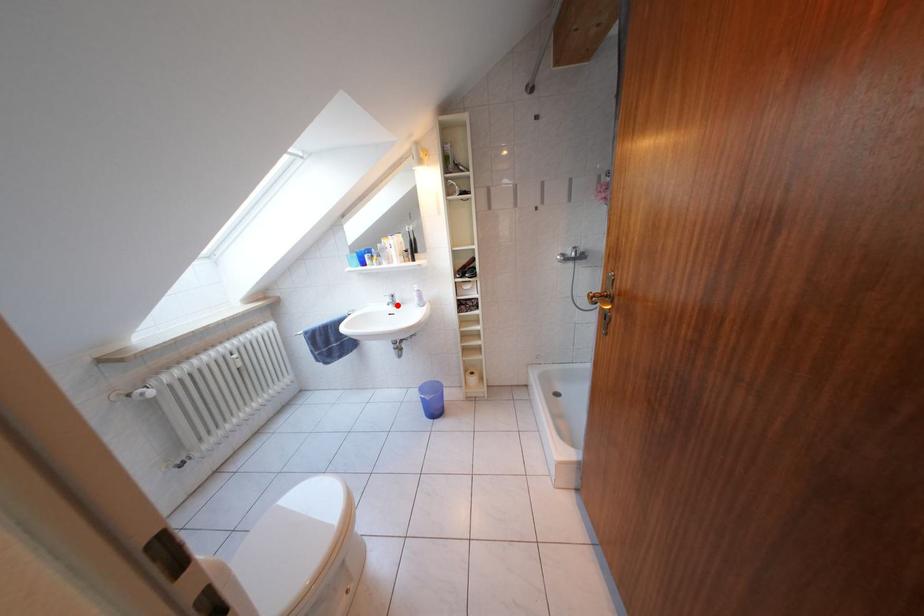
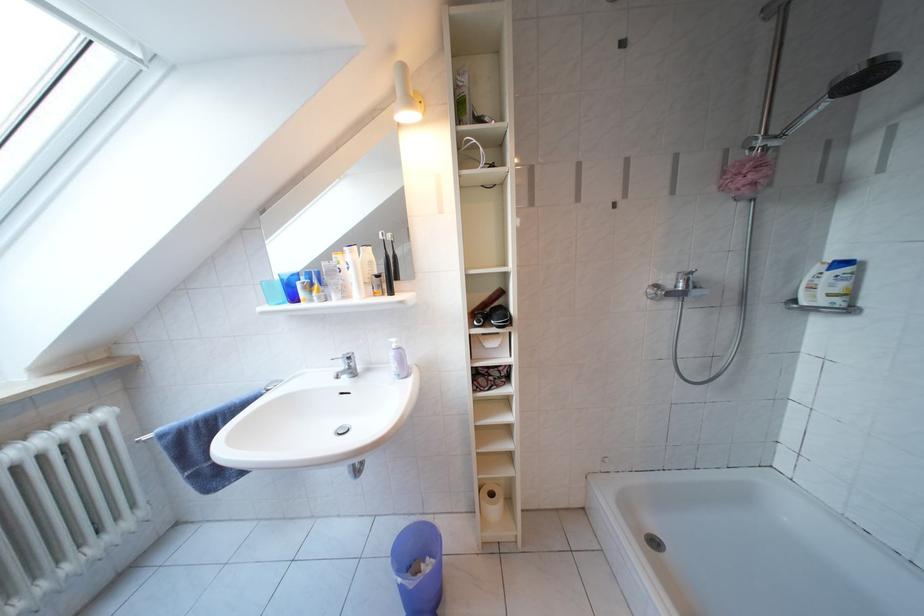
Locate, in the second image, the point that corresponds to the highlighted location in the first image.

(349, 371)